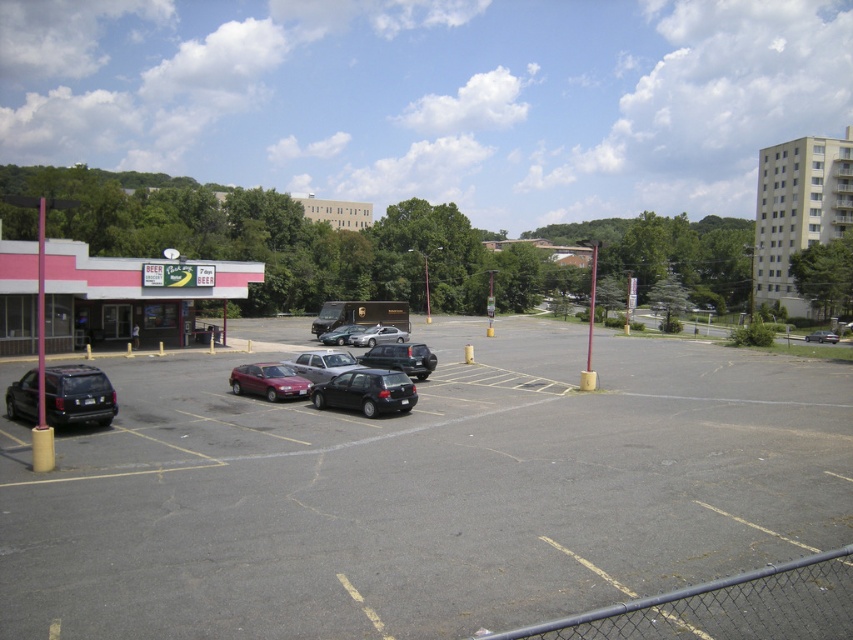
Question: Estimate the real-world distances between objects in this image. Which object is closer to the matte black suv at lower left?

Choices:
 (A) matte black van at center
 (B) satin black sedan at center
 (C) shiny black sedan at center

Answer: (C)

Question: Which point is farther from the camera taking this photo?

Choices:
 (A) (848, 536)
 (B) (357, 376)

Answer: (B)

Question: Estimate the real-world distances between objects in this image. Which object is closer to the satin black sedan at center?

Choices:
 (A) silver metallic sedan at center
 (B) maroon metallic hatchback at center
 (C) silver metallic sedan at lower right
 (D) shiny black sedan at center

Answer: (D)

Question: Does dark gray asphalt parking lot at center have a lesser width compared to shiny black sedan at center?

Choices:
 (A) no
 (B) yes

Answer: (A)

Question: Does maroon metallic hatchback at center have a larger size compared to matte black van at center?

Choices:
 (A) no
 (B) yes

Answer: (B)

Question: Observing the image, what is the correct spatial positioning of maroon metallic hatchback at center in reference to matte black van at center?

Choices:
 (A) left
 (B) right

Answer: (B)